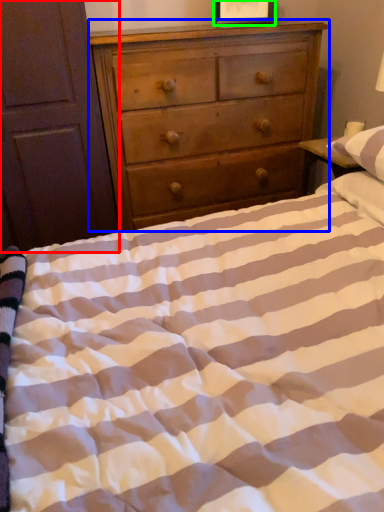
Question: Considering the real-world distances, which object is closest to armoire (highlighted by a red box)? chest of drawers (highlighted by a blue box) or picture frame (highlighted by a green box).

Choices:
 (A) chest of drawers
 (B) picture frame

Answer: (A)